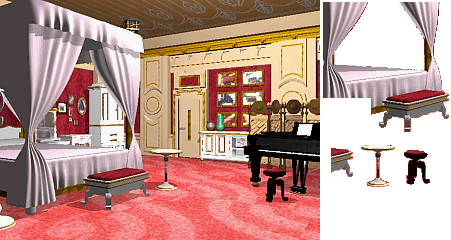
You are a GUI agent. You are given a task and a screenshot of the screen. Output one action in this format:
    pyautogui.click(x=<x>, y=<y>)
    Task: Click on the table
    The height and width of the screenshot is (240, 451).
    Given the screenshot: What is the action you would take?
    pyautogui.click(x=370, y=145)